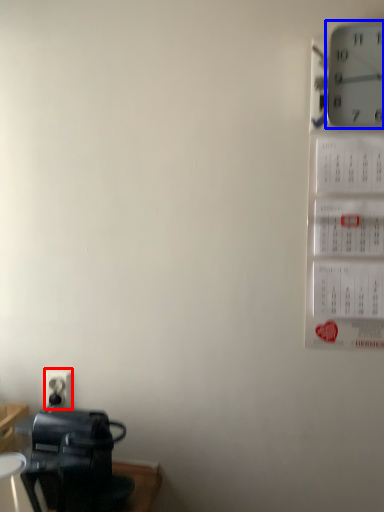
Question: Which point is further to the camera, electric outlet (highlighted by a red box) or wall clock (highlighted by a blue box)?

Choices:
 (A) electric outlet
 (B) wall clock

Answer: (A)